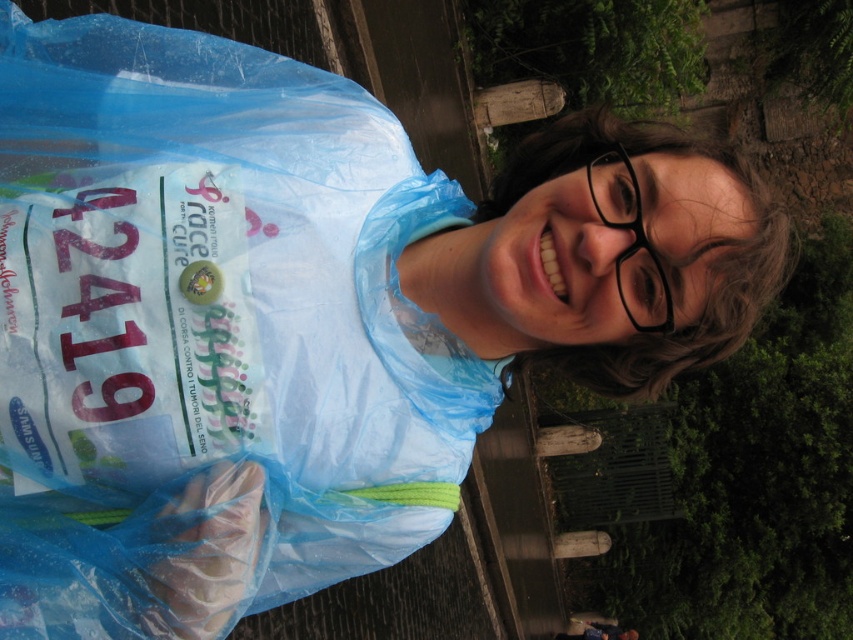
Question: Where is translucent blue plastic bag at center located in relation to black plastic glasses at upper right in the image?

Choices:
 (A) above
 (B) below

Answer: (B)

Question: Does translucent blue plastic bag at center have a larger size compared to black plastic glasses at upper right?

Choices:
 (A) yes
 (B) no

Answer: (A)

Question: Which object is farther from the camera taking this photo?

Choices:
 (A) black plastic glasses at upper right
 (B) translucent blue plastic bag at center

Answer: (A)

Question: Does translucent blue plastic bag at center have a larger size compared to black plastic glasses at upper right?

Choices:
 (A) yes
 (B) no

Answer: (A)